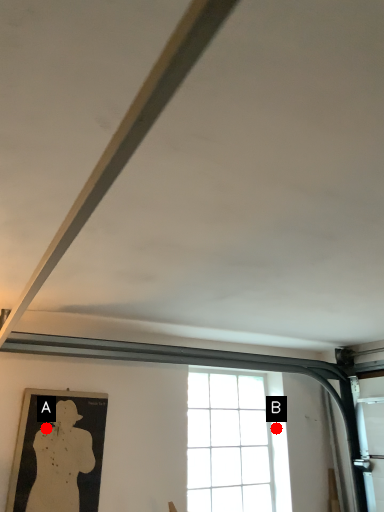
Question: Two points are circled on the image, labeled by A and B beside each circle. Which point is closer to the camera?

Choices:
 (A) A is closer
 (B) B is closer

Answer: (A)